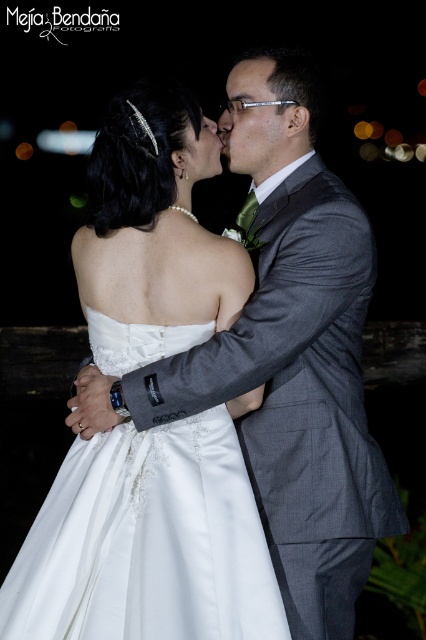
What are the coordinates of the white satin dress at center in the image?

The white satin dress at center is located at coordinates point (146, 541).

You are a photographer standing 2 meters away from the center of the scene. You want to capture a photo where both the white satin dress at center and the matte black forehead at center are in focus. Given that your camera has a depth of field that can cover 1.5 meters, will you be able to achieve this?

The distance between the white satin dress at center and the matte black forehead at center is 1.44 meters. Since the camera can cover 1.5 meters with its depth of field, the photographer can achieve both objects in focus.